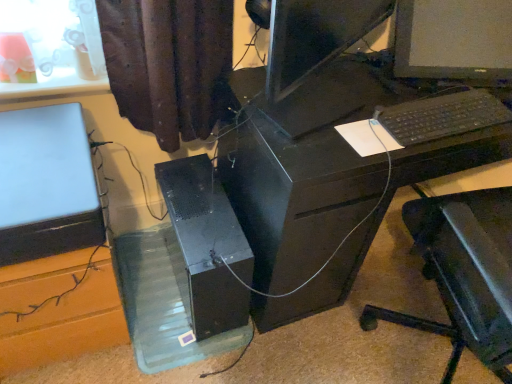
Find the location of `vacant space underneath black plastic keyboard at right (from a real-world perspective)`. vacant space underneath black plastic keyboard at right (from a real-world perspective) is located at coordinates (440, 112).